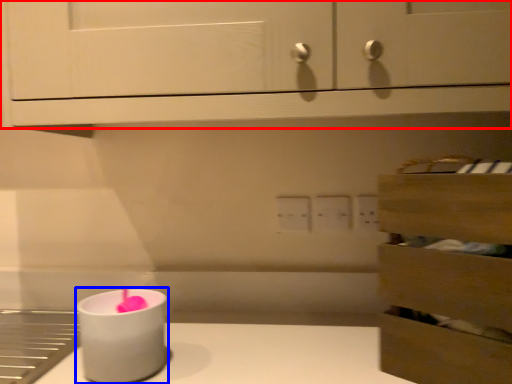
Question: Which of the following is the farthest to the observer, cabinetry (highlighted by a red box) or candle holder (highlighted by a blue box)?

Choices:
 (A) cabinetry
 (B) candle holder

Answer: (B)